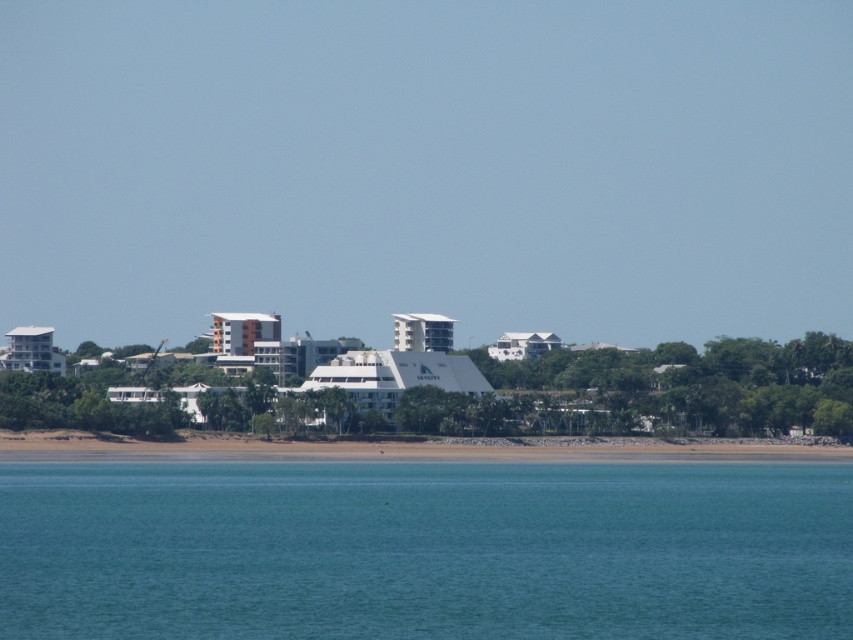
Between clear blue water at lower center and white glossy hotel at center, which one has more height?

clear blue water at lower center

Which is more to the right, clear blue water at lower center or white glossy hotel at center?

white glossy hotel at center

This screenshot has height=640, width=853. What are the coordinates of `clear blue water at lower center` in the screenshot? It's located at (425, 548).

The height and width of the screenshot is (640, 853). Identify the location of clear blue water at lower center. (425, 548).

Can you confirm if white glossy building at left is positioned to the right of white glossy hotel at center?

No, white glossy building at left is not to the right of white glossy hotel at center.

Between point (13, 353) and point (537, 340), which one is positioned behind?

The point (13, 353) is more distant.

The width and height of the screenshot is (853, 640). I want to click on white glossy building at left, so click(x=32, y=349).

Which is in front, point (354, 355) or point (416, 332)?

Positioned in front is point (416, 332).

Does white matte building at center appear over white glossy building at center?

No, white matte building at center is not above white glossy building at center.

Locate an element on the screen. Image resolution: width=853 pixels, height=640 pixels. white matte building at center is located at coordinates (393, 376).